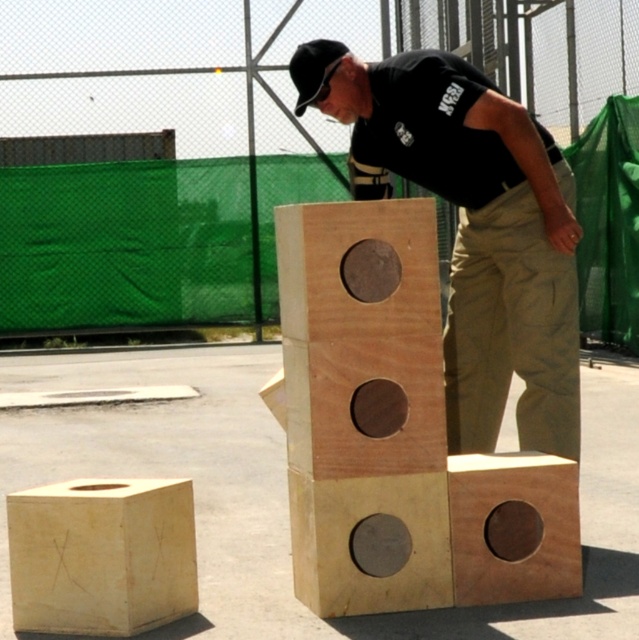
Consider the image. You are a person trying to step over the matte brown wooden block at center. You are wearing khaki pants at center. Can you step over it without touching the block?

The matte brown wooden block at center might be wider than khaki pants at center, so there is a possibility that stepping over it might not be safe as the block could be wider than your pants span. It is advisable to check the width before attempting.

You are standing in the parking lot and see the matte brown wooden block at center and the light wood block at lower left. Which block is closer to you?

The matte brown wooden block at center is closer to you because it is further to the viewer than the light wood block at lower left, meaning it appears nearer in the image.

You are a photographer trying to capture a photo of the natural wood block at center and the black matte baseball hat at upper center. If you want to ensure both subjects are fully visible in the frame, which object should you position closer to the camera?

The natural wood block at center is taller than the black matte baseball hat at upper center, so you should position the black matte baseball hat at upper center closer to the camera to ensure both are fully visible in the frame.